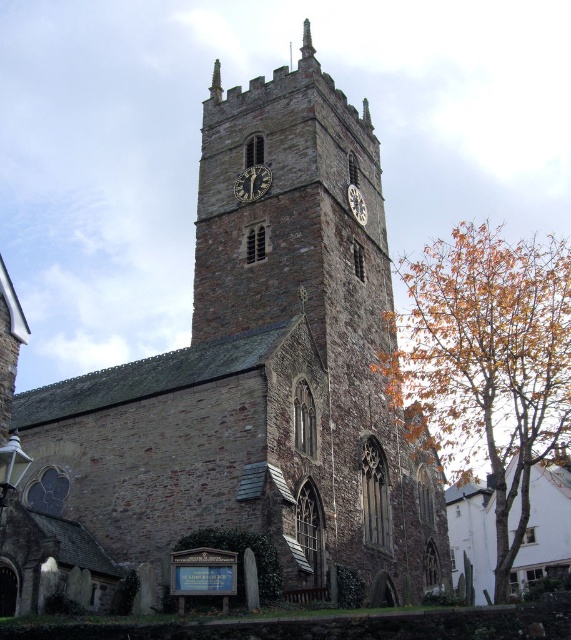
Question: Which point is closer to the camera?

Choices:
 (A) (x=260, y=180)
 (B) (x=351, y=188)

Answer: (A)

Question: Is dark brown wooden clock at center below metallic clock face at center?

Choices:
 (A) yes
 (B) no

Answer: (B)

Question: Does dark brown wooden clock at center have a greater width compared to metallic clock face at center?

Choices:
 (A) no
 (B) yes

Answer: (A)

Question: Observing the image, what is the correct spatial positioning of dark brown wooden clock at center in reference to metallic clock face at center?

Choices:
 (A) below
 (B) above

Answer: (B)